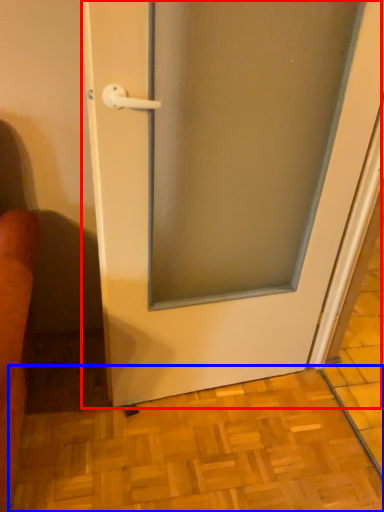
Question: Which object is closer to the camera taking this photo, door (highlighted by a red box) or tile (highlighted by a blue box)?

Choices:
 (A) door
 (B) tile

Answer: (A)